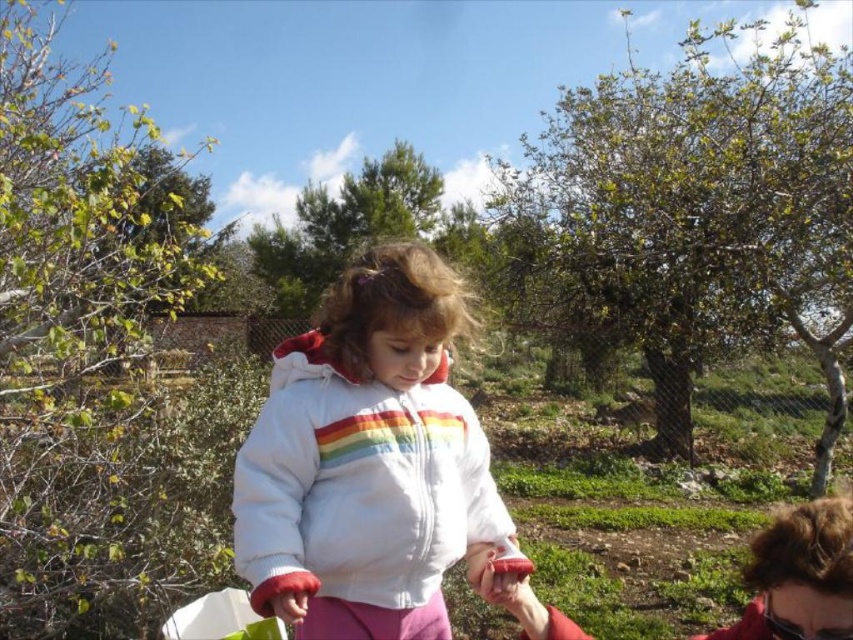
You are a photographer setting up a shot in the garden. You want to focus on the white fleece jacket at center and the matte red sweater at lower right. Which object should you adjust your camera focus on first if you want to ensure both are in focus?

The white fleece jacket at center is closer to the viewer than the matte red sweater at lower right. To ensure both are in focus, you should focus on the white fleece jacket at center first, as it is closer, and the matte red sweater at lower right will fall into the depth of field behind it.

You are a fashion designer observing the outdoor scene. You notice the white fleece jacket at center and the matte red sweater at lower right. Which clothing item has a bigger size?

The white fleece jacket at center has a larger size compared to the matte red sweater at lower right.

You are a fashion designer observing the outdoor scene. You need to decide which clothing item has a greater width between the white fleece jacket at center and the matte red sweater at lower right. Which one should you choose?

The white fleece jacket at center has a greater width than the matte red sweater at lower right, so you should choose the white fleece jacket at center.